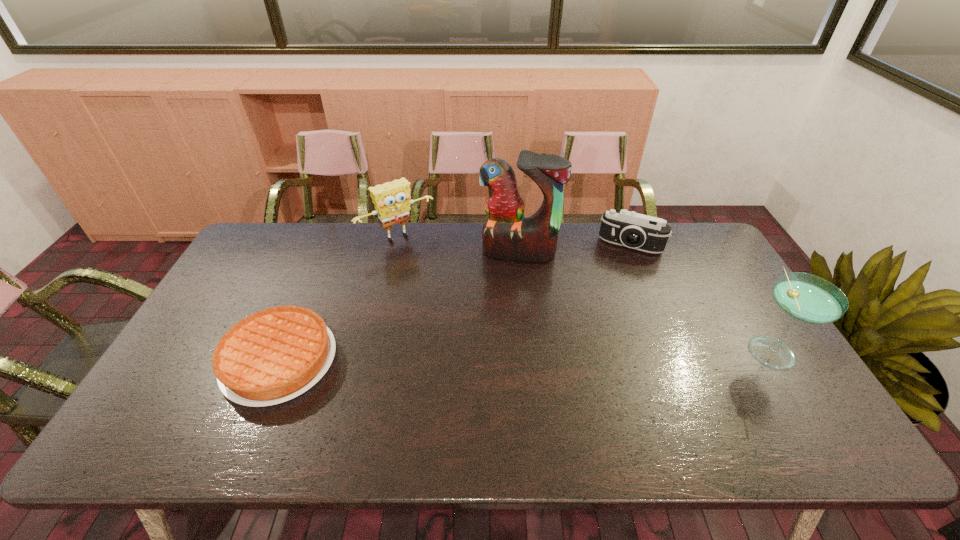
This screenshot has height=540, width=960. Identify the location of vacant space located at the face of the third object from right to left. (509, 274).

Identify the location of vacant space located 0.240m at the face of the third object from right to left. Image resolution: width=960 pixels, height=540 pixels. (498, 316).

The height and width of the screenshot is (540, 960). I want to click on vacant space positioned 0.060m on the face of the sponge, so click(422, 260).

Locate an element on the screen. vacant region located on the face of the sponge is located at coordinates (422, 260).

Find the location of a particular element. This screenshot has width=960, height=540. vacant space located 0.060m on the face of the sponge is located at coordinates (422, 260).

The width and height of the screenshot is (960, 540). I want to click on blank area located 0.220m on the front lens of the camera, so click(x=607, y=296).

Identify the location of vacant space located 0.340m on the front lens of the camera. The image size is (960, 540). (597, 323).

Locate an element on the screen. vacant space situated 0.070m on the front lens of the camera is located at coordinates (617, 267).

Image resolution: width=960 pixels, height=540 pixels. In order to click on parrot located at the far edge in this screenshot , I will do `click(507, 234)`.

This screenshot has height=540, width=960. Find the location of `sponge positioned at the far edge`. sponge positioned at the far edge is located at coordinates (392, 202).